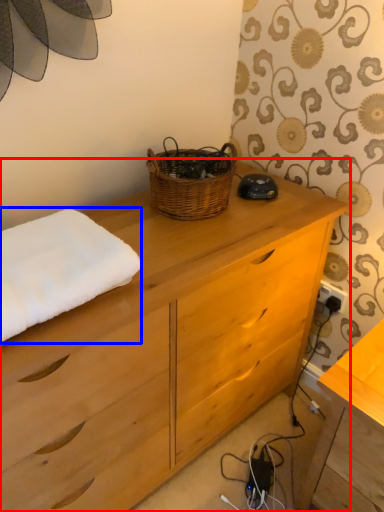
Question: Which point is closer to the camera, chest of drawers (highlighted by a red box) or bath towel (highlighted by a blue box)?

Choices:
 (A) chest of drawers
 (B) bath towel

Answer: (A)